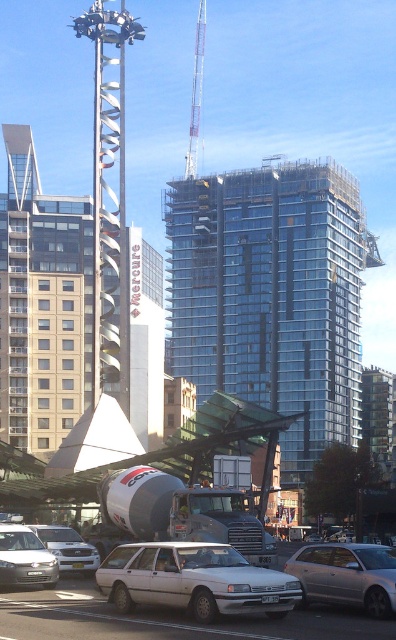
Consider the image. You are a city planner evaluating the urban layout. Given the transparent glass building at center and the white matte sedan at lower left, which structure would cast a longer shadow at noon? Explain your reasoning based on their relative sizes and positions.

The transparent glass building at center is much taller than the white matte sedan at lower left, so it would cast a longer shadow at noon due to its greater height.